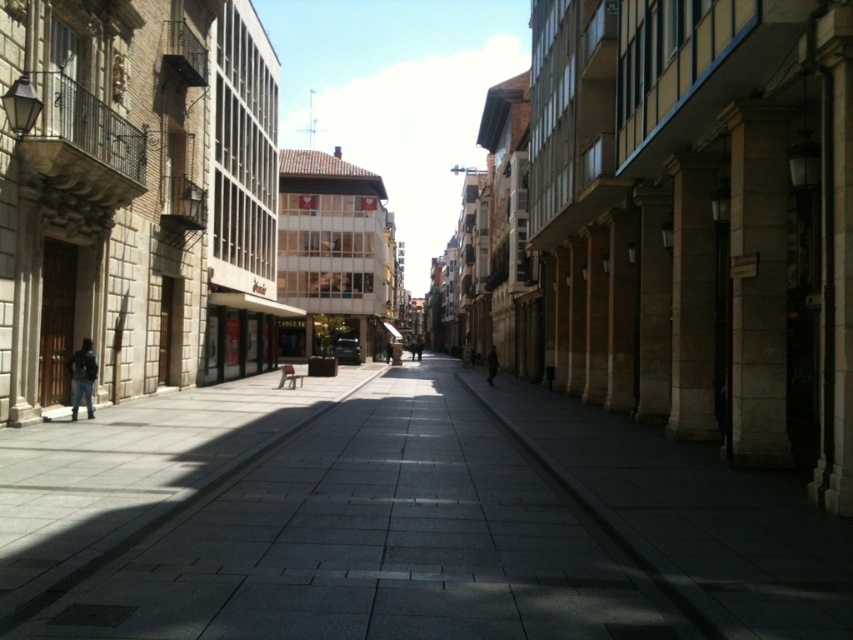
You are standing on the gray stone pavement at center and want to reach the brown wool coat at center. Which direction should you move to get closer to the coat?

Since the gray stone pavement at center is closer to the viewer than the brown wool coat at center, you should move forward along the street towards the coat to get closer to it.

You are a tailor who needs to determine which clothing item requires more fabric to make between the dark blue jacket at left and the brown wool coat at center. Which one would need more fabric?

The brown wool coat at center requires more fabric because it is thicker than the dark blue jacket at left.